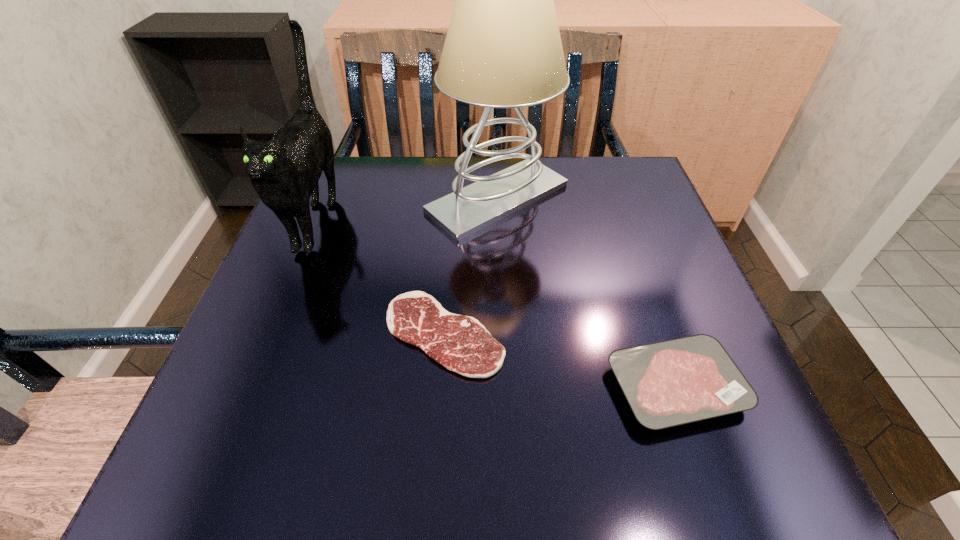
The width and height of the screenshot is (960, 540). What are the coordinates of `the tallest object` in the screenshot? It's located at (503, 49).

Identify the location of the third shortest object. (284, 171).

You are a GUI agent. You are given a task and a screenshot of the screen. Output one action in this format:
    pyautogui.click(x=<x>, y=<y>)
    Task: Click on the leftmost object
    Image resolution: width=960 pixels, height=540 pixels.
    Given the screenshot: What is the action you would take?
    pyautogui.click(x=284, y=171)

Image resolution: width=960 pixels, height=540 pixels. I want to click on the right steak, so click(x=678, y=381).

Where is `the taller steak`? This screenshot has height=540, width=960. the taller steak is located at coordinates (678, 381).

Identify the location of the left steak. (460, 343).

This screenshot has height=540, width=960. In order to click on the shortest object in this screenshot , I will do `click(460, 343)`.

Locate an element on the screen. vacant region located 0.260m on the front of the tallest object is located at coordinates (504, 343).

I want to click on free space located on the face of the leftmost object, so click(x=236, y=418).

Find the location of a particular element. This screenshot has width=960, height=540. vacant area situated 0.140m on the left of the taller steak is located at coordinates (519, 387).